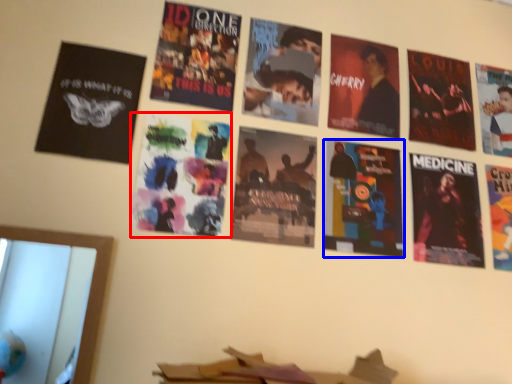
Question: Which point is further to the camera, poster (highlighted by a red box) or poster (highlighted by a blue box)?

Choices:
 (A) poster
 (B) poster

Answer: (B)